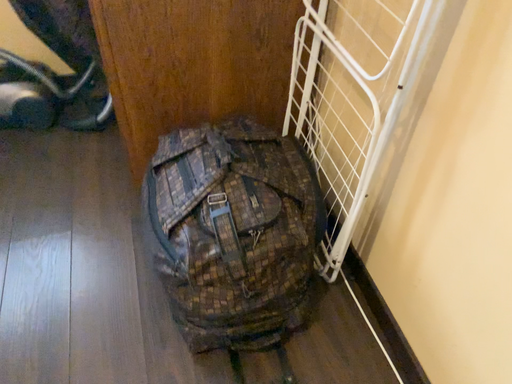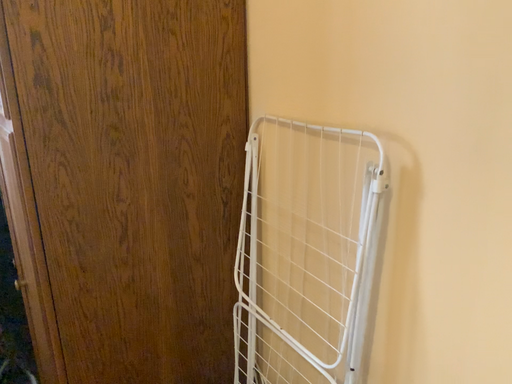
Question: Which way did the camera rotate in the video?

Choices:
 (A) rotated right
 (B) rotated left

Answer: (A)